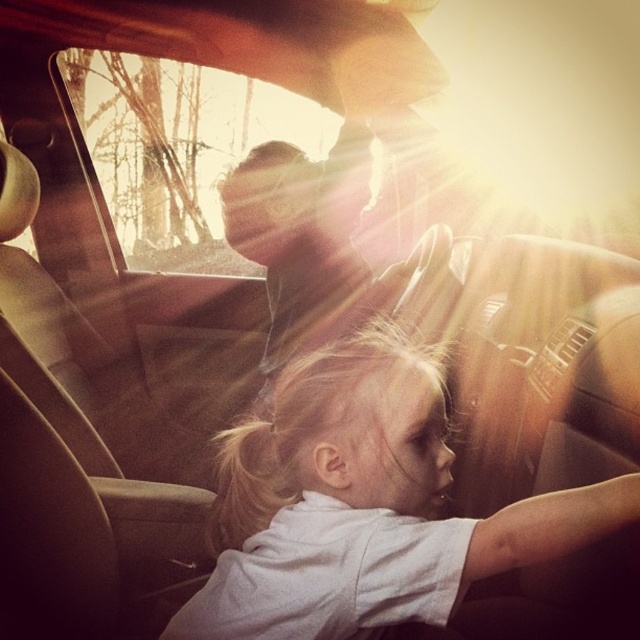
Question: Is white cotton shirt at center above transparent glass car window at upper center?

Choices:
 (A) yes
 (B) no

Answer: (B)

Question: Among these points, which one is nearest to the camera?

Choices:
 (A) (428, 604)
 (B) (104, 51)

Answer: (A)

Question: Considering the relative positions of white cotton shirt at center and transparent glass car window at upper center in the image provided, where is white cotton shirt at center located with respect to transparent glass car window at upper center?

Choices:
 (A) right
 (B) left

Answer: (A)

Question: Which of the following is the closest to the observer?

Choices:
 (A) [x=337, y=573]
 (B) [x=132, y=212]

Answer: (A)

Question: Observing the image, what is the correct spatial positioning of white cotton shirt at center in reference to transparent glass car window at upper center?

Choices:
 (A) above
 (B) below

Answer: (B)

Question: Which of the following is the closest to the observer?

Choices:
 (A) white cotton shirt at center
 (B) transparent glass car window at upper center

Answer: (A)